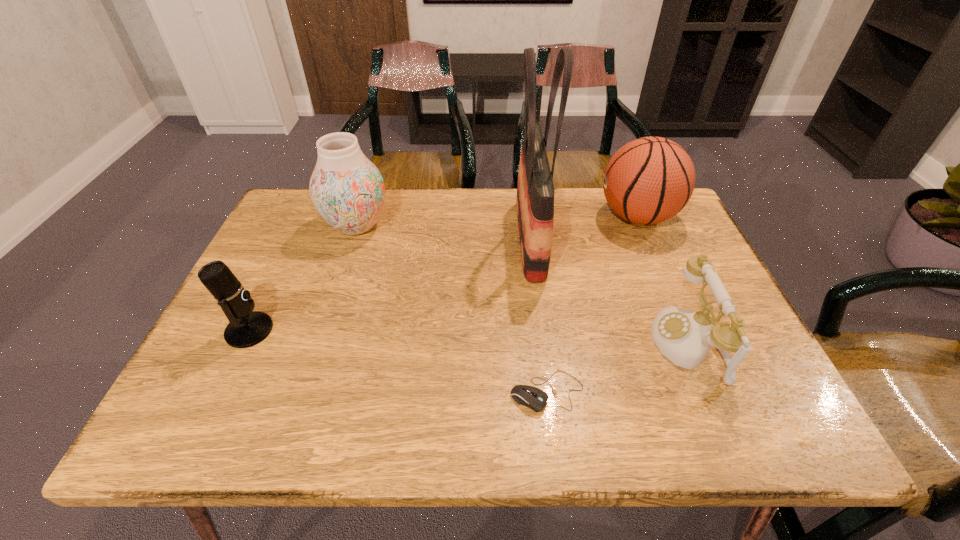
Locate an element on the screen. The height and width of the screenshot is (540, 960). free spot between the telephone and the leftmost object is located at coordinates (468, 338).

Where is `free space between the basketball and the fifth object from right to left`? The image size is (960, 540). free space between the basketball and the fifth object from right to left is located at coordinates (497, 221).

Locate an element on the screen. This screenshot has height=540, width=960. vacant area that lies between the leftmost object and the tallest object is located at coordinates (390, 285).

The height and width of the screenshot is (540, 960). I want to click on free spot between the telephone and the basketball, so click(x=662, y=281).

Select which object appears as the closest to the leftmost object. Please provide its 2D coordinates. Your answer should be formatted as a tuple, i.e. [(x, y)], where the tuple contains the x and y coordinates of a point satisfying the conditions above.

[(347, 189)]

Identify which object is the fifth closest to the telephone. Please provide its 2D coordinates. Your answer should be formatted as a tuple, i.e. [(x, y)], where the tuple contains the x and y coordinates of a point satisfying the conditions above.

[(247, 328)]

You are a GUI agent. You are given a task and a screenshot of the screen. Output one action in this format:
    pyautogui.click(x=<x>, y=<y>)
    Task: Click on the blank area in the image that satisfies the following two spatial constraints: 1. on the front-facing side of the tallest object; 2. on the front side of the shortest object
    The image size is (960, 540).
    Given the screenshot: What is the action you would take?
    pyautogui.click(x=550, y=393)

Where is `vacant space that satisfies the following two spatial constraints: 1. on the side where the inflation valve is located; 2. on the front side of the shortest object`? vacant space that satisfies the following two spatial constraints: 1. on the side where the inflation valve is located; 2. on the front side of the shortest object is located at coordinates (713, 393).